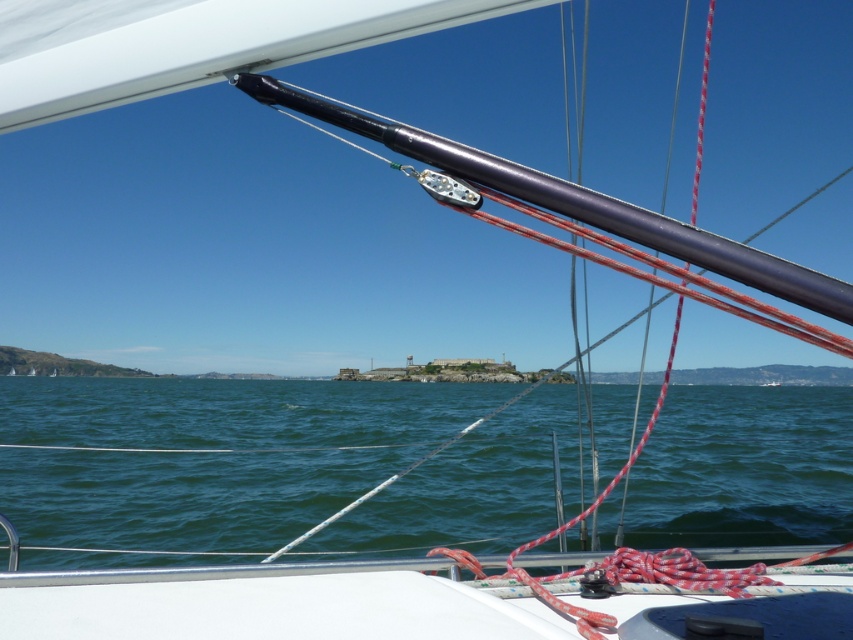
You are standing on the deck of the sailboat and want to locate the point marked at coordinates (x=209, y=454). Based on the scene description, where would this point be located relative to the green water at center?

The point marked at coordinates (x=209, y=454) is located on the green water at center.

You are a sailor on the deck of the sailboat and need to secure a rope that is 100 feet long to the polished metal mast at upper center. The rope is currently anchored at the edge of the green water at center. Can you reach the mast with the rope?

The distance between the green water at center and the polished metal mast at upper center is 132.44 feet. Since the rope is only 100 feet long, it is not long enough to reach the mast from the water.

You are navigating a sailboat and need to adjust the sail. You see the green water at center and the polished metal mast at upper center. Which object is positioned to the left when viewed from your current position on the deck?

The green water at center is to the left of the polished metal mast at upper center.